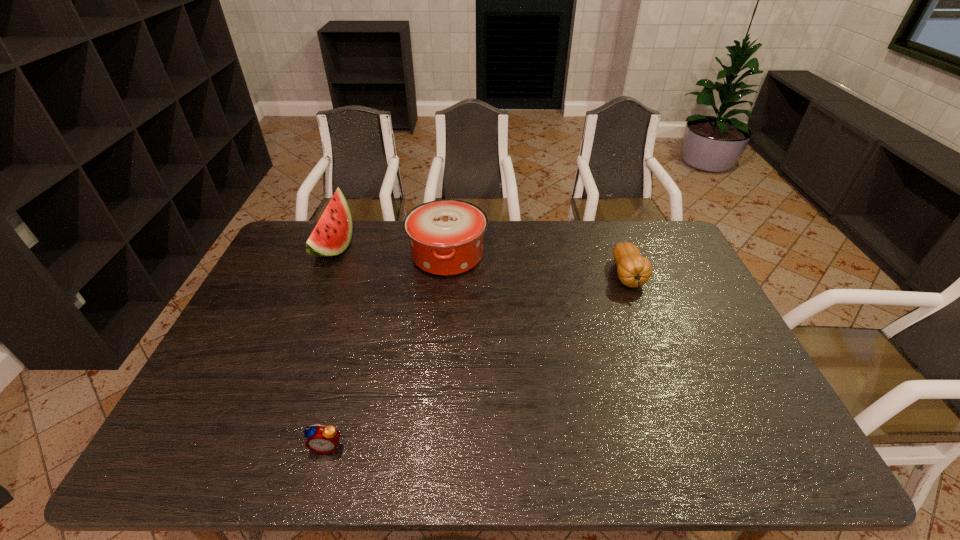
The image size is (960, 540). I want to click on gourd located in the far edge section of the desktop, so click(633, 270).

Locate an element on the screen. The height and width of the screenshot is (540, 960). object that is at the near edge is located at coordinates (322, 439).

I want to click on object located in the left edge section of the desktop, so click(x=331, y=236).

Where is `object present at the far left corner`? Image resolution: width=960 pixels, height=540 pixels. object present at the far left corner is located at coordinates (331, 236).

In the image, there is a desktop. Where is `vacant space at the far edge`? This screenshot has width=960, height=540. vacant space at the far edge is located at coordinates (588, 222).

I want to click on vacant space at the near edge, so [366, 434].

Find the location of a particular element. vacant space at the left edge is located at coordinates (276, 342).

The height and width of the screenshot is (540, 960). In the image, there is a desktop. Identify the location of vacant space at the right edge. (712, 351).

You are a GUI agent. You are given a task and a screenshot of the screen. Output one action in this format:
    pyautogui.click(x=<x>, y=<y>)
    Task: Click on the vacant space at the far right corner of the desktop
    The width and height of the screenshot is (960, 540).
    Given the screenshot: What is the action you would take?
    pyautogui.click(x=669, y=255)

Find the location of a particular element. vacant region between the alarm clock and the leftmost object is located at coordinates (330, 347).